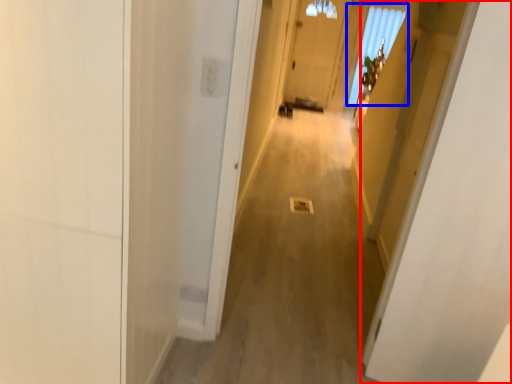
Question: Which object appears closest to the camera in this image, door (highlighted by a red box) or window (highlighted by a blue box)?

Choices:
 (A) door
 (B) window

Answer: (A)